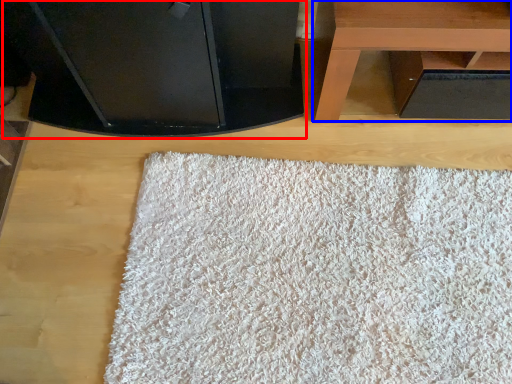
Question: Which of the following is the closest to the observer, furniture (highlighted by a red box) or table (highlighted by a blue box)?

Choices:
 (A) furniture
 (B) table

Answer: (A)